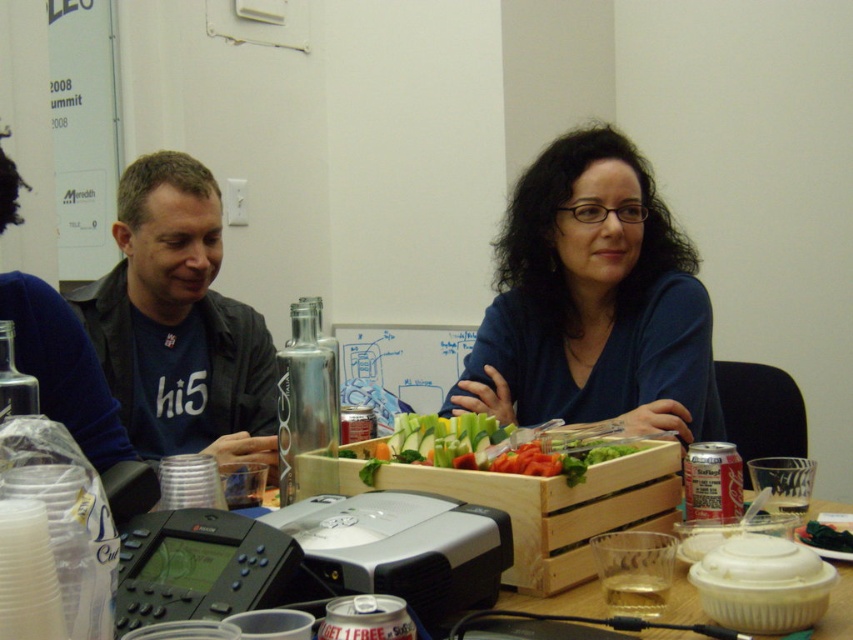
You are standing at the camera position and want to throw a ball to a friend located at point [183,384]. If the ball travels in a straight line, how far will it travel?

The ball will travel 1.72 meters to reach the friend at point [183,384].

You are standing in the room and want to hand a document to the person wearing the blue matte shirt at center. Based on their position in the room, which direction should you walk to reach them?

The blue matte shirt at center is located at coordinates point (x=593, y=301), so you should walk towards the center of the room to reach them.

You are organizing a charity event and need to decide which of the two items to donate based on their sizes. The items are the blue matte shirt at center and the matte black jacket at left. Which item has a larger size?

The blue matte shirt at center is bigger than the matte black jacket at left, so the blue matte shirt at center has a larger size and should be chosen for donation if size is a priority.